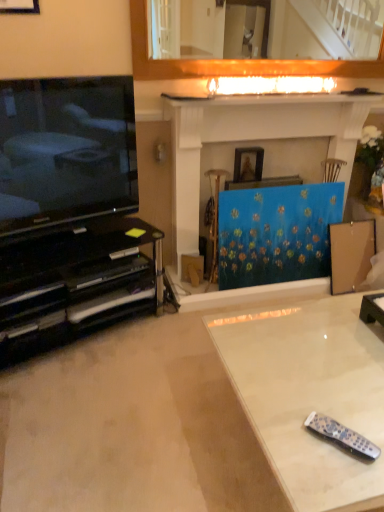
This screenshot has height=512, width=384. I want to click on free space in front of black plastic remote at lower right, so click(x=339, y=483).